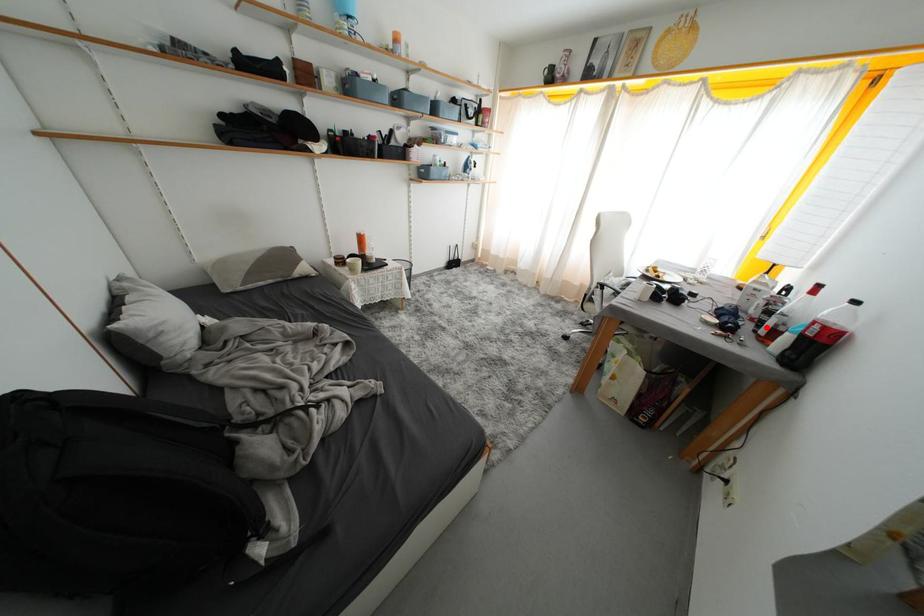
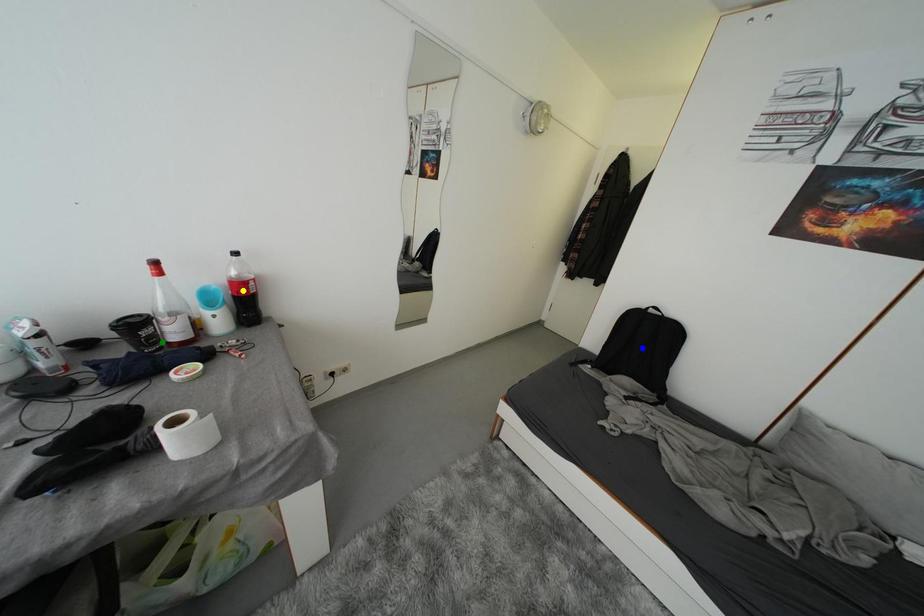
Question: I am providing you with two images of the same scene from different viewpoints. A red point is marked on the first image. You are given multiple points on the second image. Which point in image 2 represents the same 3d spot as the red point in image 1?

Choices:
 (A) green point
 (B) yellow point
 (C) blue point

Answer: (A)